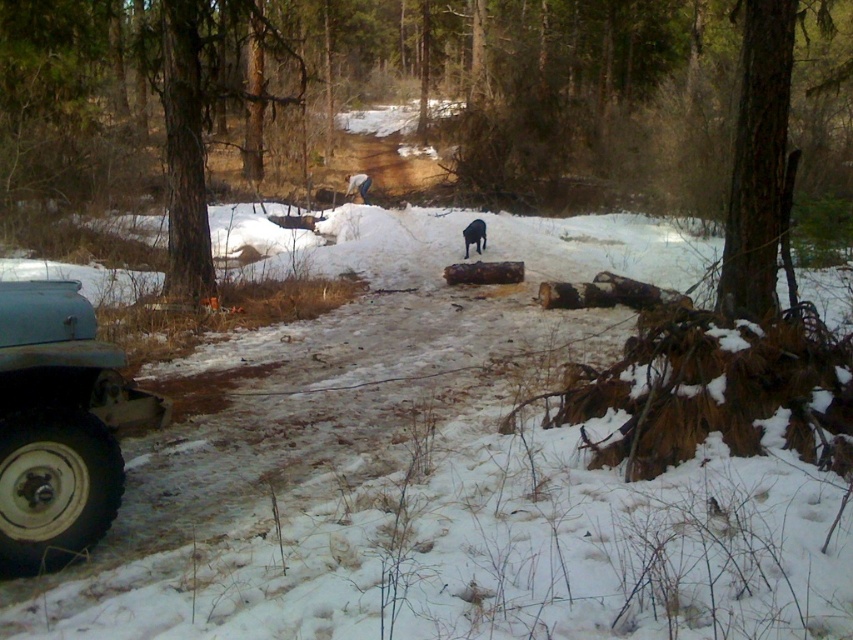
Consider the image. You are a hiker who needs to cross the path between the rusty metal jeep at lower left and the brown rough tree at upper right. The path is narrow. If your backpack is 1.5 meters wide, can you safely pass through the gap between them?

The distance between the rusty metal jeep at lower left and the brown rough tree at upper right is 3.86 meters. Since your backpack is 1.5 meters wide, there is enough space to pass safely as 3.86 meters is greater than 1.5 meters.

You are a hiker lost in the snowy forest. You see a rusty metal jeep at lower left and a black fur dog at center. The dog is barking loudly. Can you safely approach the dog from the jeep to ask for help?

The rusty metal jeep at lower left is 10.93 meters away from black fur dog at center. Since the distance is over 10 meters, it is advisable to maintain a safe distance and not approach the dog directly. Instead, you should call for help or use a whistle to signal the dog from a safe distance.

You are standing at the point with coordinates point (59,426) in the snowy forest scene. What object are you standing on?

You are standing on the rusty metal jeep at lower left.